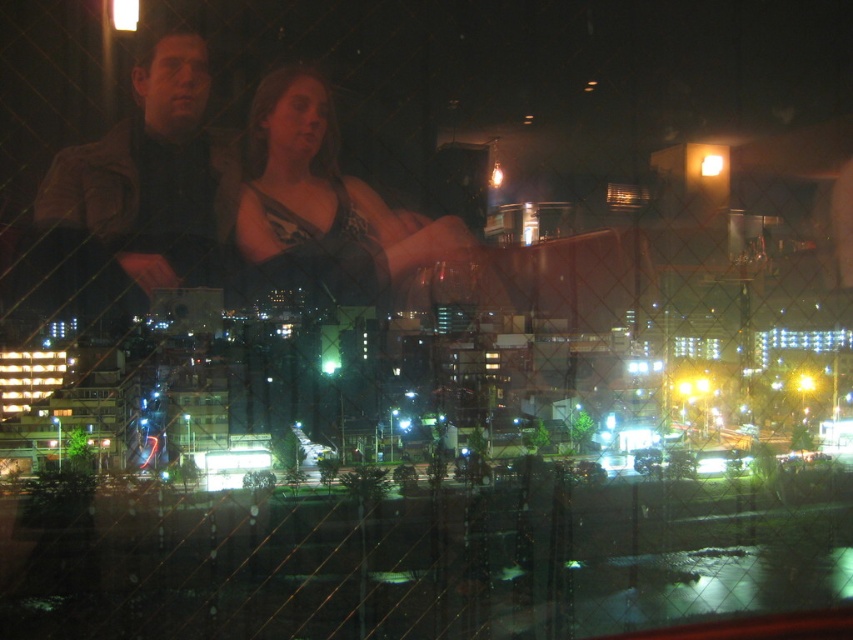
Question: Can you confirm if leather jacket at center is positioned to the right of satin black dress at center?

Choices:
 (A) yes
 (B) no

Answer: (B)

Question: Which point appears closest to the camera in this image?

Choices:
 (A) (221, 212)
 (B) (334, 177)
 (C) (55, 221)
 (D) (706, 352)

Answer: (C)

Question: Estimate the real-world distances between objects in this image. Which object is farther from the satin black dress at center?

Choices:
 (A) brown leather jacket at left
 (B) transparent glass window at center

Answer: (B)

Question: Considering the relative positions of leather jacket at center and brown leather jacket at left in the image provided, where is leather jacket at center located with respect to brown leather jacket at left?

Choices:
 (A) right
 (B) left

Answer: (A)

Question: Does leather jacket at center have a greater width compared to satin black dress at center?

Choices:
 (A) no
 (B) yes

Answer: (B)

Question: Estimate the real-world distances between objects in this image. Which object is closer to the leather jacket at center?

Choices:
 (A) brown leather jacket at left
 (B) satin black dress at center
 (C) transparent glass window at center

Answer: (B)